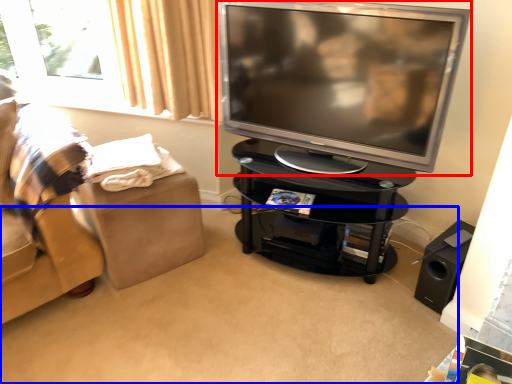
Question: Among these objects, which one is farthest to the camera, television (highlighted by a red box) or plain (highlighted by a blue box)?

Choices:
 (A) television
 (B) plain

Answer: (A)